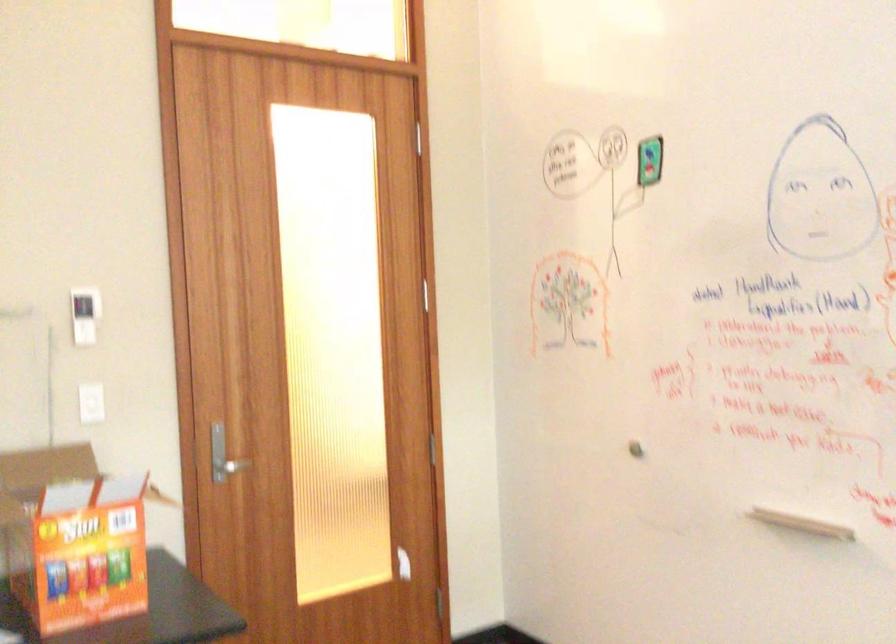
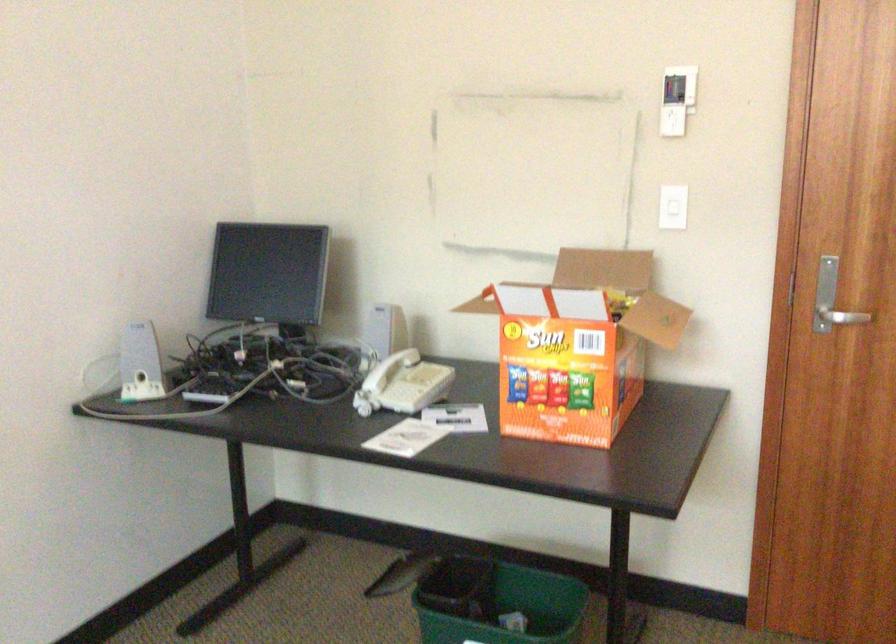
Find the pixel in the second image that matches point (105, 522) in the first image.

(578, 345)